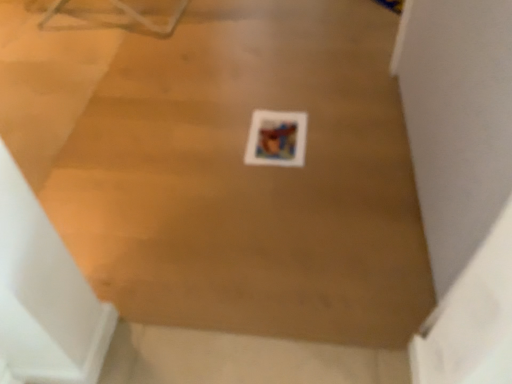
Measure the distance between point (356,289) and camera.

They are 3.96 feet apart.

Where is `wooden floor at center`? This screenshot has height=384, width=512. wooden floor at center is located at coordinates (250, 178).

What do you see at coordinates (250, 178) in the screenshot? I see `wooden floor at center` at bounding box center [250, 178].

This screenshot has width=512, height=384. Describe the element at coordinates (276, 139) in the screenshot. I see `matte paper print at center` at that location.

The width and height of the screenshot is (512, 384). Identify the location of matte paper print at center. (276, 139).

In order to click on wooden floor at center in this screenshot , I will do coord(250,178).

Which is more to the left, wooden floor at center or matte paper print at center?

From the viewer's perspective, wooden floor at center appears more on the left side.

Relative to matte paper print at center, is wooden floor at center in front or behind?

wooden floor at center is in front of matte paper print at center.

Does point (184, 66) come farther from viewer compared to point (265, 150)?

Yes, it is.

From the image's perspective, is wooden floor at center above or below matte paper print at center?

wooden floor at center is above matte paper print at center.

From a real-world perspective, which object rests below the other?

From a 3D spatial view, wooden floor at center is below.

Considering the sizes of wooden floor at center and matte paper print at center in the image, is wooden floor at center wider or thinner than matte paper print at center?

wooden floor at center is wider than matte paper print at center.

Can you confirm if wooden floor at center is shorter than matte paper print at center?

No.

Based on the photo, can you confirm if wooden floor at center is bigger than matte paper print at center?

Correct, wooden floor at center is larger in size than matte paper print at center.

Can matte paper print at center be found inside wooden floor at center?

Yes, wooden floor at center contains matte paper print at center.

Is wooden floor at center far from matte paper print at center?

wooden floor at center is near matte paper print at center, not far away.

Is wooden floor at center facing towards matte paper print at center?

No, wooden floor at center does not turn towards matte paper print at center.

What's the angular difference between wooden floor at center and matte paper print at center's facing directions?

90 degrees separate the facing orientations of wooden floor at center and matte paper print at center.

Where is `plywood on the left side of matte paper print at center`? The image size is (512, 384). plywood on the left side of matte paper print at center is located at coordinates (250, 178).

Between matte paper print at center and wooden floor at center, which one appears on the left side from the viewer's perspective?

From the viewer's perspective, wooden floor at center appears more on the left side.

Is matte paper print at center closer to camera compared to wooden floor at center?

No, the depth of matte paper print at center is greater than that of wooden floor at center.

Which is closer, (x=288, y=157) or (x=111, y=231)?

Point (x=288, y=157) is positioned farther from the camera compared to point (x=111, y=231).

From the image's perspective, is matte paper print at center under wooden floor at center?

Yes.

From a real-world perspective, which is physically below, matte paper print at center or wooden floor at center?

wooden floor at center.

Is matte paper print at center wider than wooden floor at center?

No.

Who is taller, matte paper print at center or wooden floor at center?

With more height is wooden floor at center.

Which of these two, matte paper print at center or wooden floor at center, is bigger?

wooden floor at center is bigger.

Would you say wooden floor at center is part of matte paper print at center's contents?

Definitely not — wooden floor at center is not inside matte paper print at center.

Is matte paper print at center positioned far away from wooden floor at center?

No.

Could you tell me if matte paper print at center is turned towards wooden floor at center?

Yes, matte paper print at center is facing wooden floor at center.

Can you tell me how much matte paper print at center and wooden floor at center differ in facing direction?

They differ by 90 degrees in their facing directions.

Measure the distance between matte paper print at center and wooden floor at center.

10.30 inches.

Image resolution: width=512 pixels, height=384 pixels. Find the location of `plywood in front of the matte paper print at center`. plywood in front of the matte paper print at center is located at coordinates (250, 178).

Where is `plywood that is under the matte paper print at center (from a real-world perspective)`? plywood that is under the matte paper print at center (from a real-world perspective) is located at coordinates (250, 178).

Where is `print above the wooden floor at center (from a real-world perspective)`? This screenshot has height=384, width=512. print above the wooden floor at center (from a real-world perspective) is located at coordinates (276, 139).